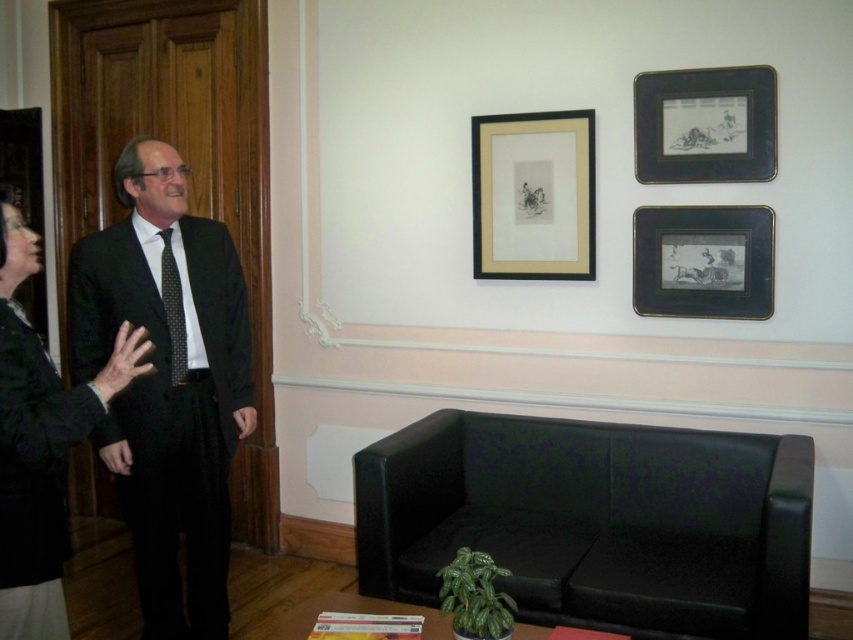
You are a tailor who needs to deliver a suit and a tie to a client. The client is standing in the room and wants to know if they can place both items on a small table that is 8 inches wide. Can the matte black suit at left and the black dotted tie at center fit side by side on the table without overlapping?

The matte black suit at left and the black dotted tie at center are 8.51 inches apart from each other. Since the table is only 8 inches wide, the items cannot fit side by side without overlapping.